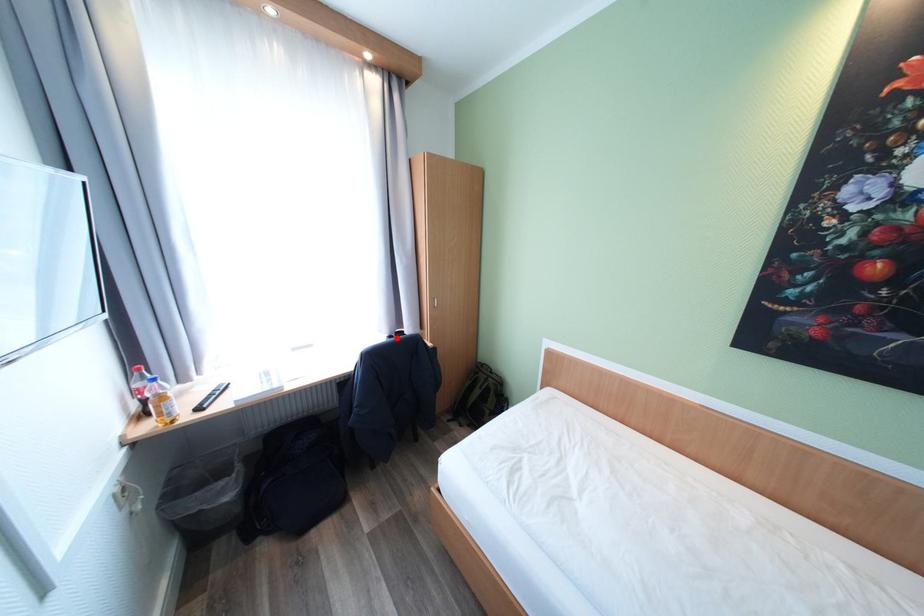
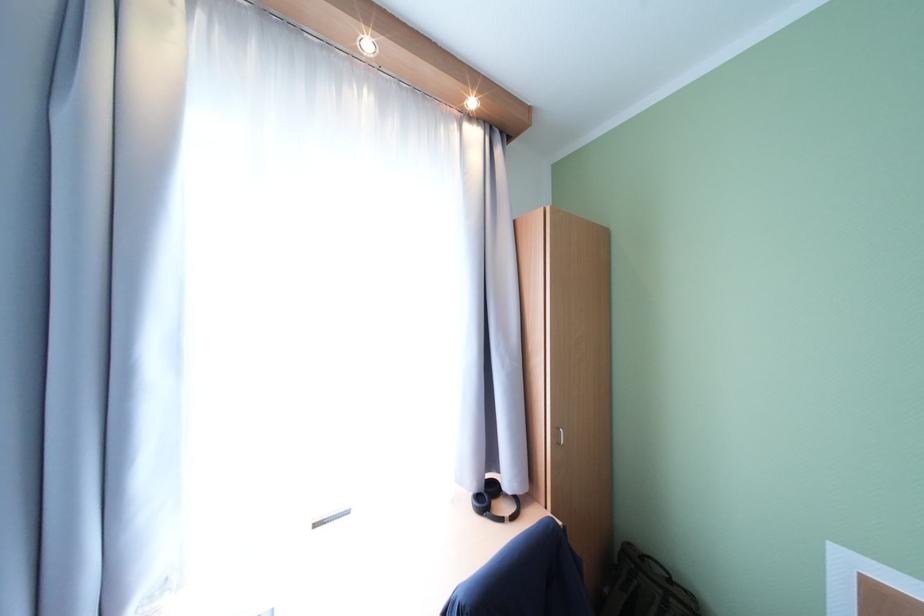
The point at the highlighted location is marked in the first image. Where is the corresponding point in the second image?

(484, 498)